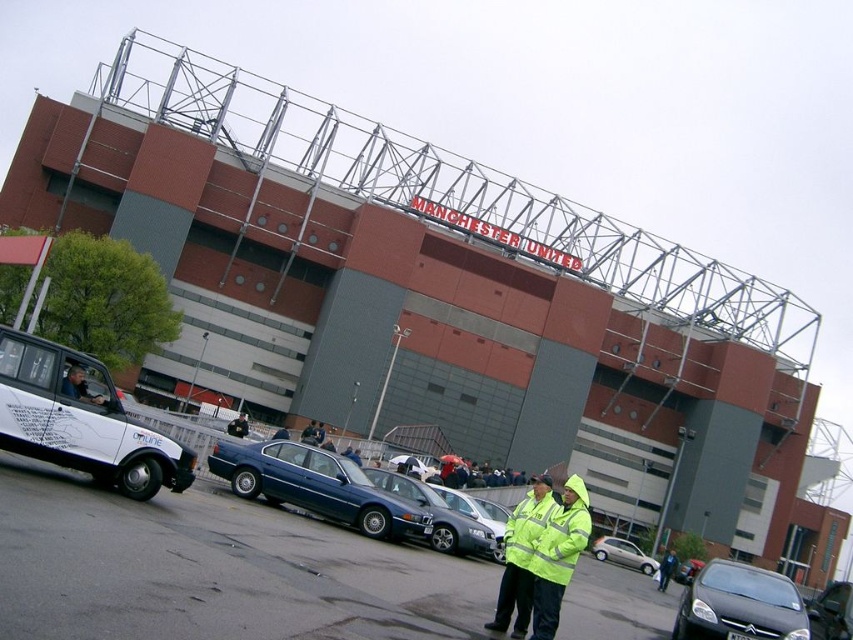
You are a photographer standing near the matte black jacket at center and want to take a picture of the silver metallic sedan at center. In which direction should you move to get a better shot?

You should move to your right since the silver metallic sedan at center is to the right of the matte black jacket at center.

You are a delivery driver who needs to park your truck between the silver metallic sedan at center and the matte black jacket at center. What is the minimum distance you need to drive to position your truck between them?

The silver metallic sedan at center and matte black jacket at center are 19.42 meters apart from each other. To park between them, the minimum distance you need to drive is 19.42 meters.